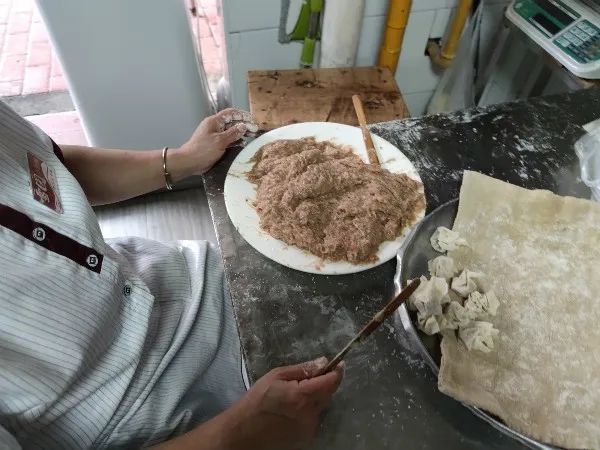
You are a GUI agent. You are given a task and a screenshot of the screen. Output one action in this format:
    pyautogui.click(x=<x>, y=<y>)
    Task: Click on the wall
    The image size is (600, 450).
    Given the screenshot: What is the action you would take?
    pyautogui.click(x=174, y=67)